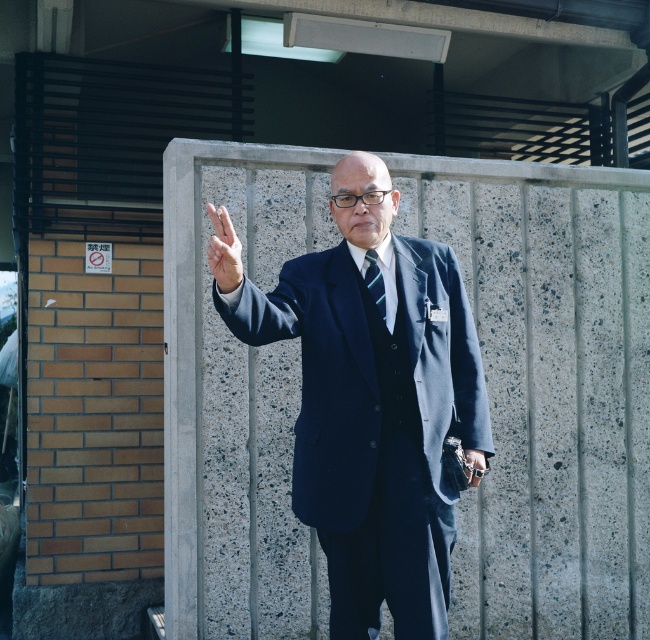
You are a photographer setting up for a portrait. The subject is wearing a navy blue suit at center and has a metallic silver watch at lower right. You need to ensure there is at least 12 inches of space between the suit and the watch in the frame to avoid clutter. Based on the scene description, will this requirement be met?

The navy blue suit at center and metallic silver watch at lower right are 13.54 inches apart, which exceeds the required 12 inches of space. Therefore, the requirement is met.

You are a photographer positioned at a certain distance from the man in the navy blue suit at center. You need to capture a closeup shot of his face without distorting the perspective. Considering the distance between you and the suit, what is the minimum focal length required for your camera lens to achieve this?

The navy blue suit at center is 3.29 meters from viewer. To capture a closeup shot without perspective distortion, the minimum focal length required would be approximately 85mm to 105mm, as shorter focal lengths may introduce distortion when photographing portraits at closer distances.

You are a photographer adjusting your camera to capture the scene. You notice two points marked in the image. Which point, point 1 at coordinates [234,248] or point 2 at coordinates [473,483], is closer to the camera?

Point 1 at coordinates [234,248] is closer to the camera than point 2 at coordinates [473,483].